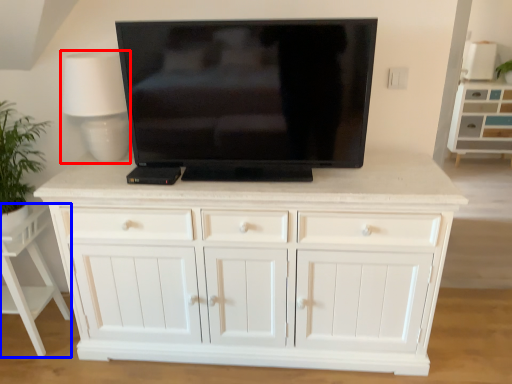
Question: Which of the following is the farthest to the observer, table lamp (highlighted by a red box) or vanity (highlighted by a blue box)?

Choices:
 (A) table lamp
 (B) vanity

Answer: (B)